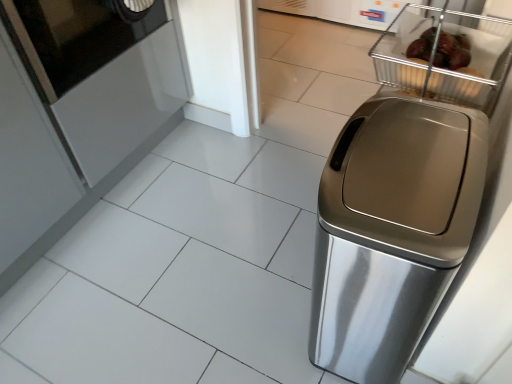
This screenshot has width=512, height=384. What are the coordinates of `free space to the left of satin silver trash can at right` in the screenshot? It's located at (257, 306).